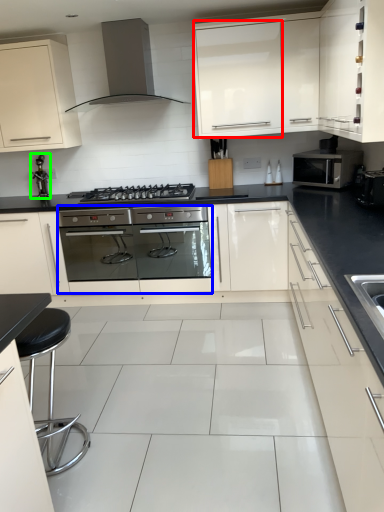
Question: Which object is positioned farthest from glass door (highlighted by a red box)? Select from oven (highlighted by a blue box) and faucet (highlighted by a green box).

Choices:
 (A) oven
 (B) faucet

Answer: (B)